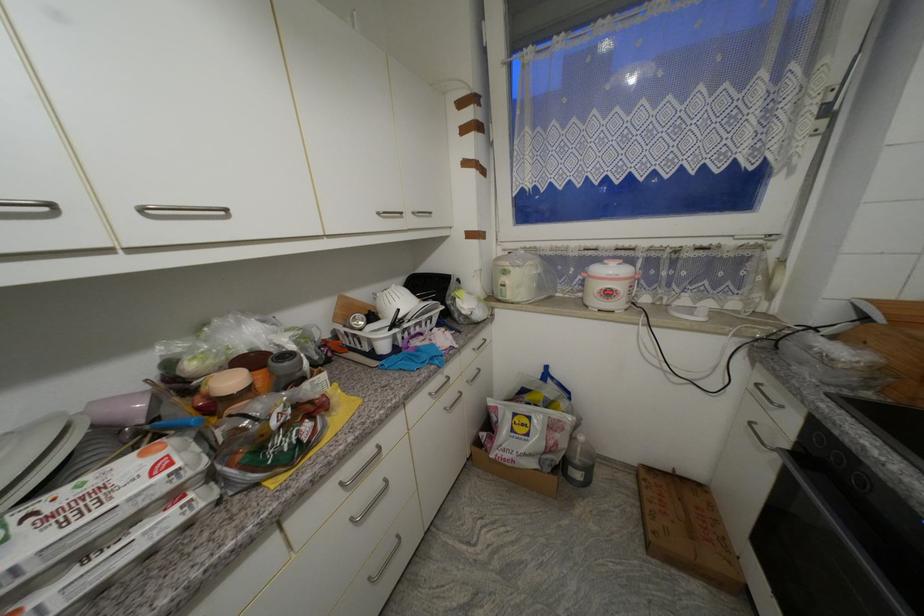
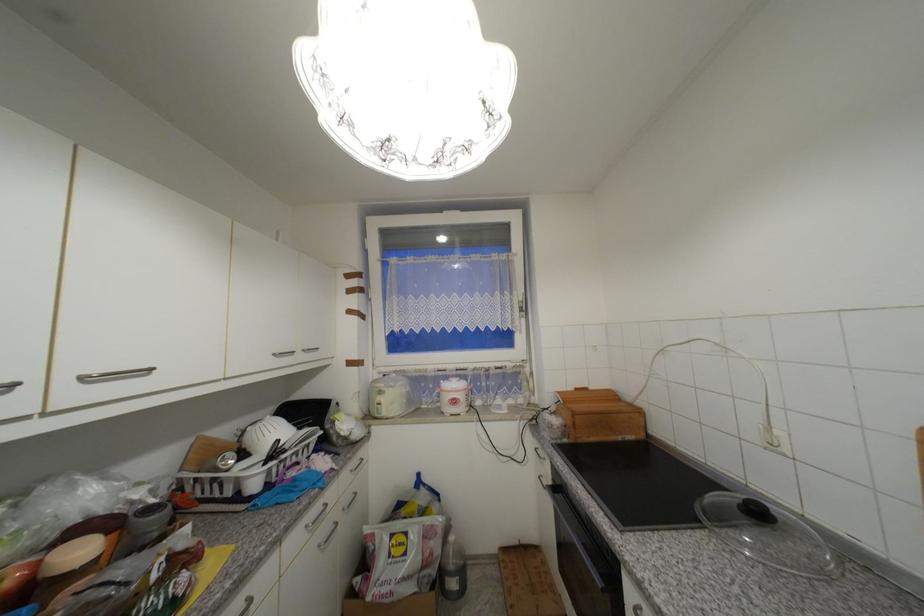
The point at (x=149, y=211) is marked in the first image. Where is the corresponding point in the second image?

(89, 379)